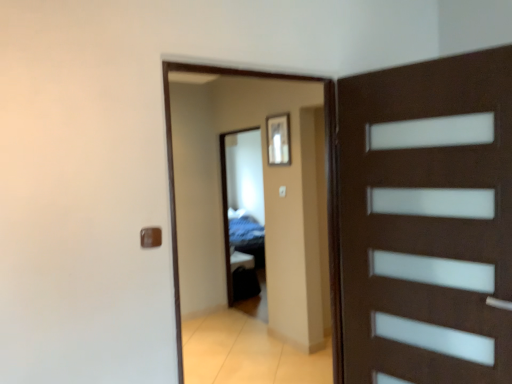
Question: From their relative heights in the image, would you say transparent glass door at center is taller or shorter than brown matte door handle at lower left?

Choices:
 (A) tall
 (B) short

Answer: (A)

Question: Is point (266, 72) closer or farther from the camera than point (145, 246)?

Choices:
 (A) farther
 (B) closer

Answer: (A)

Question: Based on their relative distances, which object is farther from the brown matte door handle at lower left?

Choices:
 (A) transparent glass mirror at center
 (B) transparent glass door at center

Answer: (A)

Question: Estimate the real-world distances between objects in this image. Which object is farther from the brown matte door handle at lower left?

Choices:
 (A) transparent glass mirror at center
 (B) transparent glass door at center

Answer: (A)